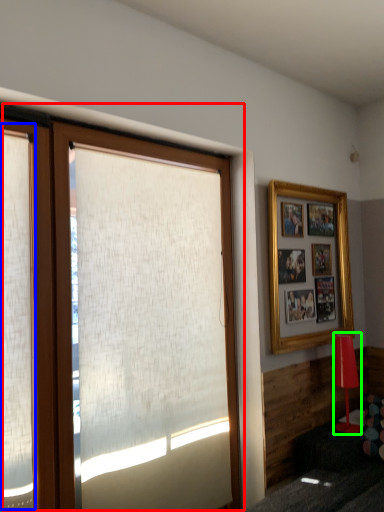
Question: Considering the real-world distances, which object is closest to window (highlighted by a red box)? shutter (highlighted by a blue box) or lamp (highlighted by a green box).

Choices:
 (A) shutter
 (B) lamp

Answer: (A)